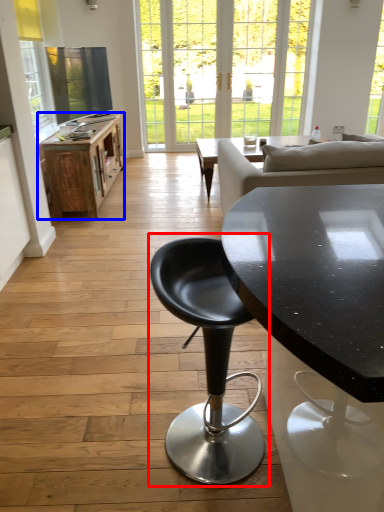
Question: Among these objects, which one is nearest to the camera, chair (highlighted by a red box) or table (highlighted by a blue box)?

Choices:
 (A) chair
 (B) table

Answer: (A)